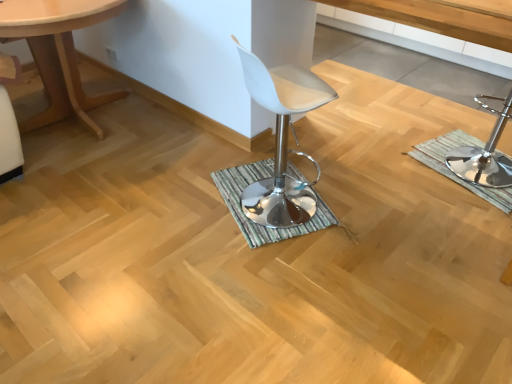
Question: From a real-world perspective, relative to green striped bath mat at center, the second bath mat in the right-to-left sequence, is light wood table at left vertically above or below?

Choices:
 (A) above
 (B) below

Answer: (A)

Question: In terms of height, does light wood table at left look taller or shorter compared to green striped bath mat at center, the second bath mat in the right-to-left sequence?

Choices:
 (A) tall
 (B) short

Answer: (A)

Question: Estimate the real-world distances between objects in this image. Which object is closer to the green striped bath mat at center, the second bath mat in the right-to-left sequence?

Choices:
 (A) light wood table at left
 (B) green striped bath mat at right, the first bath mat viewed from the right
 (C) polished chrome bar stool at right
 (D) white leather stool at center
 (E) white plastic stool at center

Answer: (D)

Question: Which of these objects is positioned closest to the white plastic stool at center?

Choices:
 (A) white leather stool at center
 (B) green striped bath mat at center, which is counted as the 1th bath mat, starting from the left
 (C) polished chrome bar stool at right
 (D) light wood table at left
 (E) green striped bath mat at right, the first bath mat viewed from the right

Answer: (A)